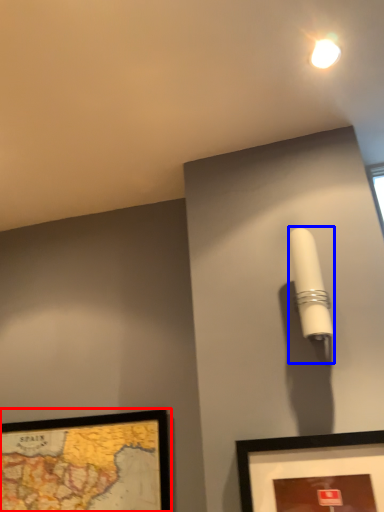
Question: Which object appears closest to the camera in this image, picture frame (highlighted by a red box) or table lamp (highlighted by a blue box)?

Choices:
 (A) picture frame
 (B) table lamp

Answer: (B)